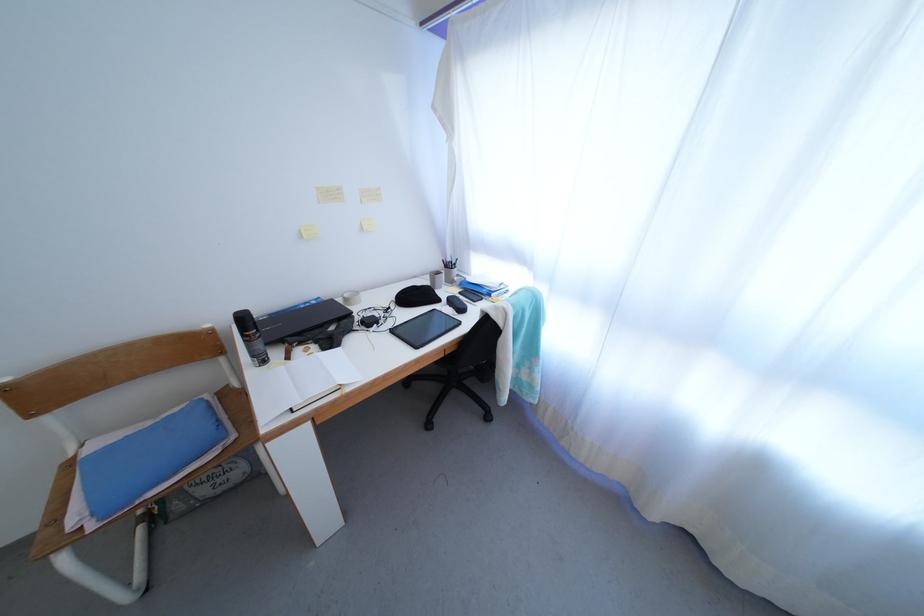
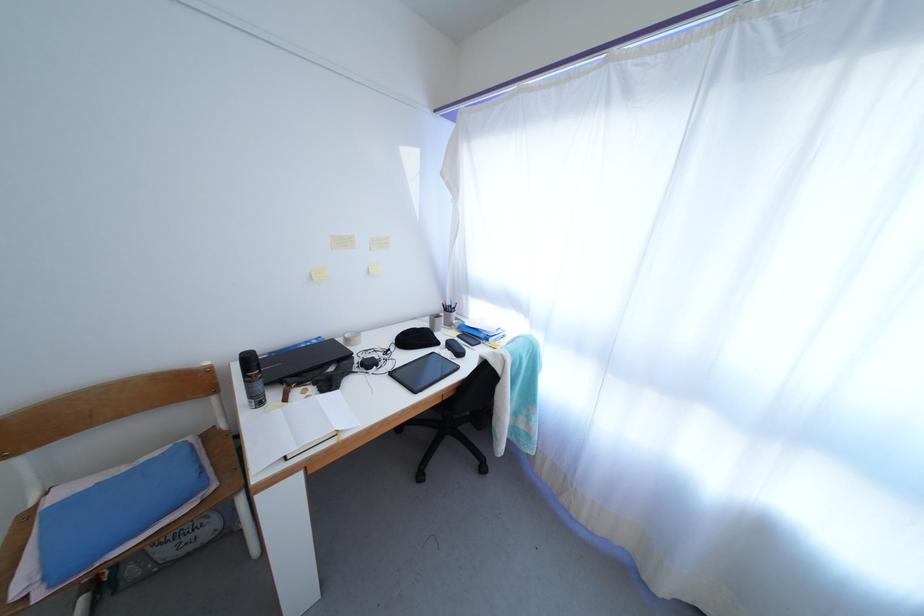
The point at (351, 301) is marked in the first image. Where is the corresponding point in the second image?

(353, 341)